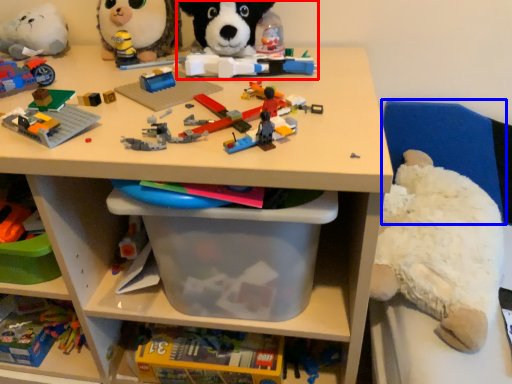
Question: Which object appears closest to the camera in this image, toy (highlighted by a red box) or chair (highlighted by a blue box)?

Choices:
 (A) toy
 (B) chair

Answer: (A)